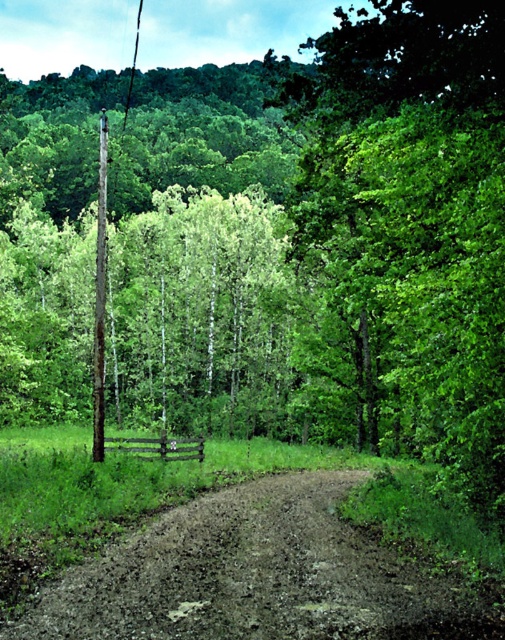
Looking at this image, you are a hiker carrying a 1.5 meter long backpack. You come across the brown wooden telegraph pole at left and the smooth wire at upper center. Which object is more likely to obstruct your path if you walk along the dirt path?

The smooth wire at upper center is more likely to obstruct your path because it is larger in size compared to the brown wooden telegraph pole at left.

You are a hiker walking along the dirt path in the rural landscape. You notice the brown wooden telegraph pole at left and the smooth wire at upper center. Which object is nearer to you as you stand on the path?

The brown wooden telegraph pole at left is closer to the viewer than the smooth wire at upper center, so the telegraph pole is nearer to you.